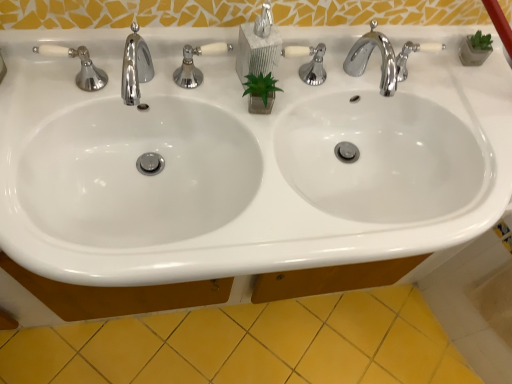
This screenshot has height=384, width=512. I want to click on free space to the left of matte gray soap dispenser at center, so click(185, 75).